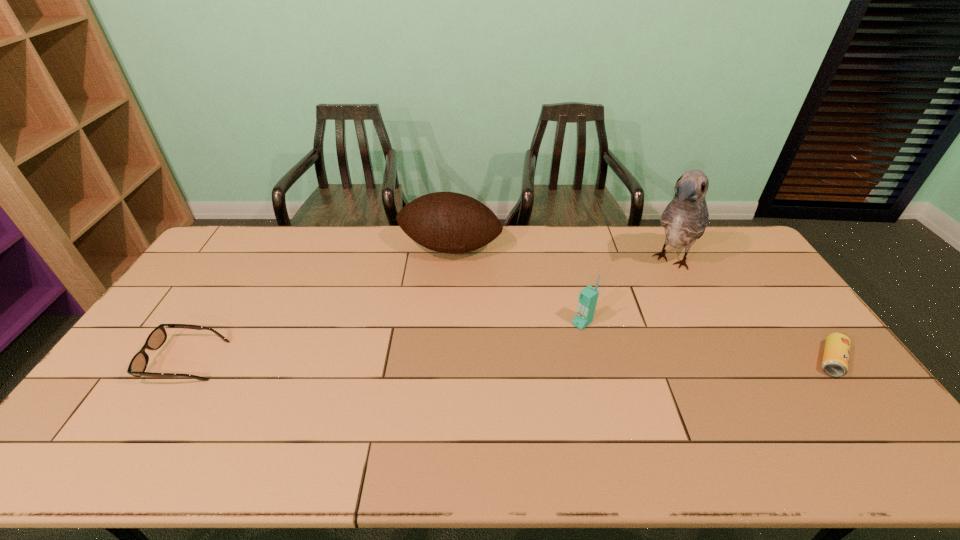
Find the location of `free space on the desktop that is between the spectacles and the beer can and is positioned on the laces of the fourth object from right to left`. free space on the desktop that is between the spectacles and the beer can and is positioned on the laces of the fourth object from right to left is located at coordinates tap(413, 361).

Locate an element on the screen. The width and height of the screenshot is (960, 540). free space on the desktop that is between the spectacles and the shortest object and is positioned on the front-facing side of the tallest object is located at coordinates (599, 360).

Find the location of `vacant spot on the desktop that is between the leftmost object and the shortest object and is positioned on the keypad of the cellular telephone`. vacant spot on the desktop that is between the leftmost object and the shortest object and is positioned on the keypad of the cellular telephone is located at coordinates (534, 361).